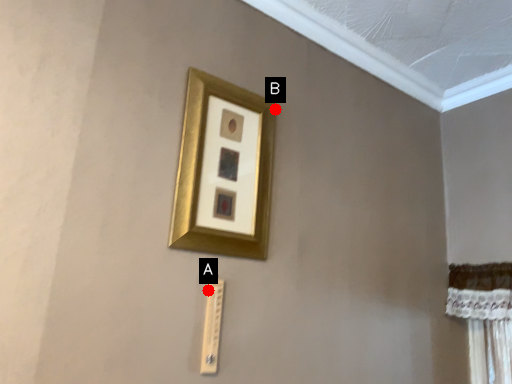
Question: Two points are circled on the image, labeled by A and B beside each circle. Which point is closer to the camera taking this photo?

Choices:
 (A) A is closer
 (B) B is closer

Answer: (A)